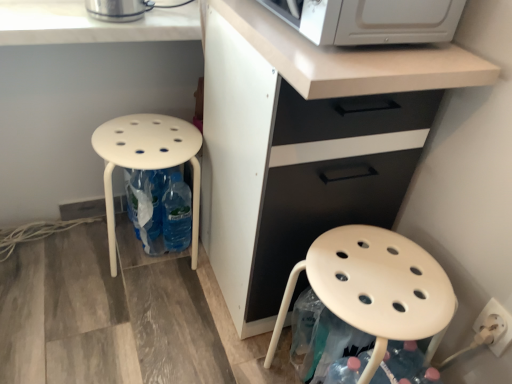
The image size is (512, 384). What are the coordinates of `white marble countertop at upper left` in the screenshot? It's located at (90, 24).

Describe the element at coordinates (90, 24) in the screenshot. This screenshot has width=512, height=384. I see `white marble countertop at upper left` at that location.

Consider the image. In order to face white plastic electric outlet at lower right, should I rotate leftwards or rightwards?

Turn right approximately 29.548 degrees to face it.

Where is `matte white stool at lower left, acting as the second stool starting from the left`? matte white stool at lower left, acting as the second stool starting from the left is located at coordinates (375, 288).

Find the location of a particular element. white marble countertop at upper left is located at coordinates (90, 24).

Which of these two, matte white stool at lower left, acting as the second stool starting from the left, or white plastic stool at lower left, placed as the 2th stool when sorted from right to left, stands shorter?

white plastic stool at lower left, placed as the 2th stool when sorted from right to left, is shorter.

Would you say matte white stool at lower left, acting as the second stool starting from the left, contains white plastic stool at lower left, placed as the 2th stool when sorted from right to left?

No.

Based on the photo, considering the positions of objects matte white stool at lower left, acting as the second stool starting from the left, and white plastic stool at lower left, placed as the 2th stool when sorted from right to left, in the image provided, who is more to the left, matte white stool at lower left, acting as the second stool starting from the left, or white plastic stool at lower left, placed as the 2th stool when sorted from right to left,?

white plastic stool at lower left, placed as the 2th stool when sorted from right to left.

How different are the orientations of matte white stool at lower left, acting as the second stool starting from the left, and white plastic stool at lower left, placed as the 2th stool when sorted from right to left, in degrees?

90 degrees separate the facing orientations of matte white stool at lower left, acting as the second stool starting from the left, and white plastic stool at lower left, placed as the 2th stool when sorted from right to left.

From a real-world perspective, which is physically above, white marble countertop at upper left or white plastic stool at lower left, the first stool viewed from the left?

white marble countertop at upper left.

Is white marble countertop at upper left looking in the opposite direction of white plastic stool at lower left, the first stool viewed from the left?

That's not correct — white marble countertop at upper left is not looking away from white plastic stool at lower left, the first stool viewed from the left.

How many degrees apart are the facing directions of white marble countertop at upper left and white plastic stool at lower left, placed as the 2th stool when sorted from right to left?

There is a 3.17-degree angle between the facing directions of white marble countertop at upper left and white plastic stool at lower left, placed as the 2th stool when sorted from right to left.

Is white marble countertop at upper left in front of or behind white plastic stool at lower left, the first stool viewed from the left, in the image?

white marble countertop at upper left is in front of white plastic stool at lower left, the first stool viewed from the left.

Which is behind, white plastic electric outlet at lower right or white matte cabinet at center?

white plastic electric outlet at lower right is behind.

Considering the relative sizes of white plastic electric outlet at lower right and white matte cabinet at center in the image provided, is white plastic electric outlet at lower right thinner than white matte cabinet at center?

Indeed, white plastic electric outlet at lower right has a lesser width compared to white matte cabinet at center.

In the image, is white plastic electric outlet at lower right on the left side or the right side of white matte cabinet at center?

From the image, it's evident that white plastic electric outlet at lower right is to the right of white matte cabinet at center.

Does white plastic electric outlet at lower right have a larger size compared to white matte cabinet at center?

No, white plastic electric outlet at lower right is not bigger than white matte cabinet at center.

From a real-world perspective, does white plastic electric outlet at lower right sit lower than white marble countertop at upper left?

Yes, from a real-world perspective, white plastic electric outlet at lower right is under white marble countertop at upper left.

Can you see white plastic electric outlet at lower right touching white marble countertop at upper left?

No, white plastic electric outlet at lower right is not in contact with white marble countertop at upper left.

Considering the sizes of objects white plastic electric outlet at lower right and white marble countertop at upper left in the image provided, who is wider, white plastic electric outlet at lower right or white marble countertop at upper left?

Wider between the two is white marble countertop at upper left.

Is white plastic electric outlet at lower right surrounding white marble countertop at upper left?

No, white plastic electric outlet at lower right does not contain white marble countertop at upper left.

From the image's perspective, who appears lower, white plastic stool at lower left, placed as the 2th stool when sorted from right to left, or white plastic electric outlet at lower right?

white plastic electric outlet at lower right is shown below in the image.

Does white plastic stool at lower left, the first stool viewed from the left, lie in front of white plastic electric outlet at lower right?

No, it is not.

From a real-world perspective, does white plastic stool at lower left, the first stool viewed from the left, sit lower than white plastic electric outlet at lower right?

Yes.

Considering the sizes of white plastic stool at lower left, the first stool viewed from the left, and white plastic electric outlet at lower right in the image, is white plastic stool at lower left, the first stool viewed from the left, bigger or smaller than white plastic electric outlet at lower right?

In the image, white plastic stool at lower left, the first stool viewed from the left, appears to be larger than white plastic electric outlet at lower right.

Considering the sizes of white plastic stool at lower left, the first stool viewed from the left, and white matte cabinet at center in the image, is white plastic stool at lower left, the first stool viewed from the left, bigger or smaller than white matte cabinet at center?

white plastic stool at lower left, the first stool viewed from the left, is smaller than white matte cabinet at center.

Consider the image. Can you tell me how much white plastic stool at lower left, placed as the 2th stool when sorted from right to left, and white matte cabinet at center differ in facing direction?

The angle between the facing direction of white plastic stool at lower left, placed as the 2th stool when sorted from right to left, and the facing direction of white matte cabinet at center is 87.2 degrees.

Could you tell me if white plastic stool at lower left, the first stool viewed from the left, is turned towards white matte cabinet at center?

No, white plastic stool at lower left, the first stool viewed from the left, is not oriented towards white matte cabinet at center.

Based on the photo, from a real-world perspective, is white plastic stool at lower left, the first stool viewed from the left, physically located above or below white matte cabinet at center?

In terms of real-world spatial position, white plastic stool at lower left, the first stool viewed from the left, is below white matte cabinet at center.

From the image's perspective, is white marble countertop at upper left below white plastic electric outlet at lower right?

No, from the image's perspective, white marble countertop at upper left is not below white plastic electric outlet at lower right.

Looking at this image, is white marble countertop at upper left bigger or smaller than white plastic electric outlet at lower right?

Clearly, white marble countertop at upper left is larger in size than white plastic electric outlet at lower right.

Locate an element on the screen. Image resolution: width=512 pixels, height=384 pixels. electric outlet that is in front of the white marble countertop at upper left is located at coordinates (x=499, y=322).

Based on their positions, is white marble countertop at upper left located to the left or right of white plastic electric outlet at lower right?

Clearly, white marble countertop at upper left is on the left of white plastic electric outlet at lower right in the image.

Image resolution: width=512 pixels, height=384 pixels. Find the location of `stool that appears below the white plastic stool at lower left, placed as the 2th stool when sorted from right to left (from a real-world perspective)`. stool that appears below the white plastic stool at lower left, placed as the 2th stool when sorted from right to left (from a real-world perspective) is located at coordinates (375, 288).

Where is `the 1st stool counting from the right of the white marble countertop at upper left`? The width and height of the screenshot is (512, 384). the 1st stool counting from the right of the white marble countertop at upper left is located at coordinates (147, 158).

Based on their spatial positions, is white plastic electric outlet at lower right or white marble countertop at upper left closer to white plastic stool at lower left, placed as the 2th stool when sorted from right to left?

white marble countertop at upper left lies closer to white plastic stool at lower left, placed as the 2th stool when sorted from right to left, than the other object.

Looking at the image, which one is located closer to matte white stool at lower left, acting as the second stool starting from the left, white matte cabinet at center or white marble countertop at upper left?

Among the two, white matte cabinet at center is located nearer to matte white stool at lower left, acting as the second stool starting from the left.

Considering their positions, is matte white stool at lower left, marked as the 1th stool in a right-to-left arrangement, positioned further to white plastic stool at lower left, placed as the 2th stool when sorted from right to left, than white marble countertop at upper left?

matte white stool at lower left, marked as the 1th stool in a right-to-left arrangement.

From the image, which object appears to be nearer to white plastic electric outlet at lower right, white plastic stool at lower left, placed as the 2th stool when sorted from right to left, or white matte cabinet at center?

Among the two, white matte cabinet at center is located nearer to white plastic electric outlet at lower right.

From the picture: Looking at the image, which one is located further to white matte cabinet at center, white plastic stool at lower left, the first stool viewed from the left, or white plastic electric outlet at lower right?

Among the two, white plastic electric outlet at lower right is located further to white matte cabinet at center.

Estimate the real-world distances between objects in this image. Which object is closer to white plastic stool at lower left, placed as the 2th stool when sorted from right to left, matte white stool at lower left, acting as the second stool starting from the left, or white plastic electric outlet at lower right?

The object closer to white plastic stool at lower left, placed as the 2th stool when sorted from right to left, is matte white stool at lower left, acting as the second stool starting from the left.

Looking at the image, which one is located closer to white matte cabinet at center, white plastic electric outlet at lower right or matte white stool at lower left, marked as the 1th stool in a right-to-left arrangement?

Among the two, matte white stool at lower left, marked as the 1th stool in a right-to-left arrangement, is located nearer to white matte cabinet at center.

Estimate the real-world distances between objects in this image. Which object is closer to white marble countertop at upper left, matte white stool at lower left, acting as the second stool starting from the left, or white plastic stool at lower left, placed as the 2th stool when sorted from right to left?

Among the two, white plastic stool at lower left, placed as the 2th stool when sorted from right to left, is located nearer to white marble countertop at upper left.

Locate an element on the screen. This screenshot has width=512, height=384. cabinetry located between white marble countertop at upper left and white plastic electric outlet at lower right in the left-right direction is located at coordinates (305, 143).

Locate an element on the screen. cabinetry between white plastic stool at lower left, the first stool viewed from the left, and matte white stool at lower left, marked as the 1th stool in a right-to-left arrangement, from left to right is located at coordinates (305, 143).

In order to click on cabinetry between white marble countertop at upper left and matte white stool at lower left, acting as the second stool starting from the left, in the up-down direction in this screenshot , I will do `click(305, 143)`.

In order to click on stool between white plastic stool at lower left, the first stool viewed from the left, and white plastic electric outlet at lower right in this screenshot , I will do `click(375, 288)`.